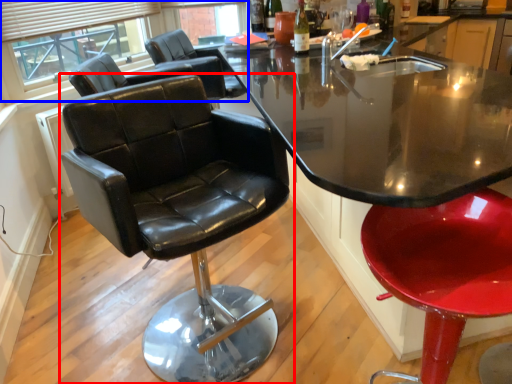
Question: Which of the following is the farthest to the observer, chair (highlighted by a red box) or bay window (highlighted by a blue box)?

Choices:
 (A) chair
 (B) bay window

Answer: (B)